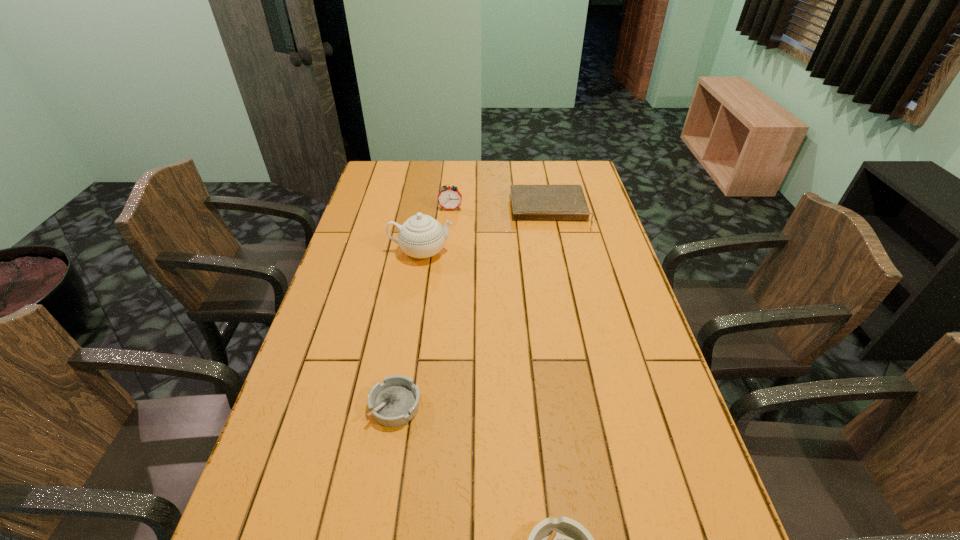
The height and width of the screenshot is (540, 960). I want to click on vacant space that's between the paperback book and the second tallest object, so click(500, 210).

Locate an element on the screen. Image resolution: width=960 pixels, height=540 pixels. blank region between the third farthest object and the paperback book is located at coordinates (486, 232).

Find the location of a particular element. This screenshot has height=540, width=960. the second closest object relative to the farther ashtray is located at coordinates (421, 236).

Select which object appears as the second closest to the nearer ashtray. Please provide its 2D coordinates. Your answer should be formatted as a tuple, i.e. [(x, y)], where the tuple contains the x and y coordinates of a point satisfying the conditions above.

[(421, 236)]

The width and height of the screenshot is (960, 540). Find the location of `vacant space that satisfies the following two spatial constraints: 1. on the clock face of the second tallest object; 2. on the spout of the tallest object`. vacant space that satisfies the following two spatial constraints: 1. on the clock face of the second tallest object; 2. on the spout of the tallest object is located at coordinates (446, 251).

Identify the location of blank area in the image that satisfies the following two spatial constraints: 1. on the spine side of the paperback book; 2. on the spout of the tallest object. (558, 251).

Where is `vacant area that satisfies the following two spatial constraints: 1. on the clock face of the fourth shortest object; 2. on the spout of the chinaware`? This screenshot has height=540, width=960. vacant area that satisfies the following two spatial constraints: 1. on the clock face of the fourth shortest object; 2. on the spout of the chinaware is located at coordinates (446, 251).